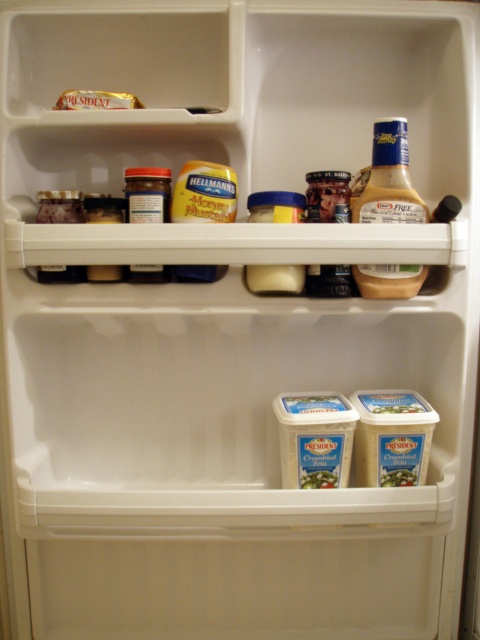
Question: Can you confirm if white creamy tub at center is thinner than gold foil wrapped cheese at upper left?

Choices:
 (A) no
 (B) yes

Answer: (B)

Question: Which point appears farthest from the camera in this image?

Choices:
 (A) (336, 289)
 (B) (336, 401)
 (C) (165, 266)
 (D) (61, 208)

Answer: (B)

Question: Does yellow mustard at center have a lesser width compared to matte glass jar at upper center?

Choices:
 (A) yes
 (B) no

Answer: (B)

Question: Which of these objects is positioned farthest from the yellow mustard at center?

Choices:
 (A) gold foil wrapped cheese at upper left
 (B) translucent plastic bottle at upper right
 (C) translucent plastic jar at center
 (D) matte glass jar at upper center

Answer: (B)

Question: Which point is farther from the camera taking this photo?

Choices:
 (A) (204, 204)
 (B) (408, 440)
 (C) (316, 284)
 (D) (405, 122)

Answer: (B)

Question: Is translucent plastic jar at center bigger than gold foil wrapped cheese at upper left?

Choices:
 (A) no
 (B) yes

Answer: (B)